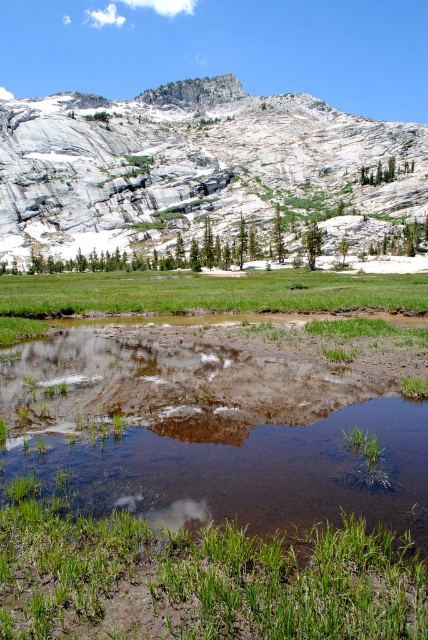
Question: Which object appears farthest from the camera in this image?

Choices:
 (A) green grass at lower center
 (B) clear water at center
 (C) white rock mountain at upper center
 (D) green grass at center

Answer: (C)

Question: Is white rock mountain at upper center further to camera compared to green grass at center?

Choices:
 (A) no
 (B) yes

Answer: (B)

Question: Can you confirm if clear water at center is thinner than white rock mountain at upper center?

Choices:
 (A) yes
 (B) no

Answer: (A)

Question: Which of the following is the closest to the observer?

Choices:
 (A) white rock mountain at upper center
 (B) green grass at lower center
 (C) clear water at center
 (D) green grass at center

Answer: (B)

Question: Can you confirm if green grass at lower center is thinner than green grass at center?

Choices:
 (A) no
 (B) yes

Answer: (B)

Question: Which of the following is the closest to the observer?

Choices:
 (A) green grass at lower center
 (B) white rock mountain at upper center
 (C) clear water at center
 (D) green grass at center

Answer: (A)